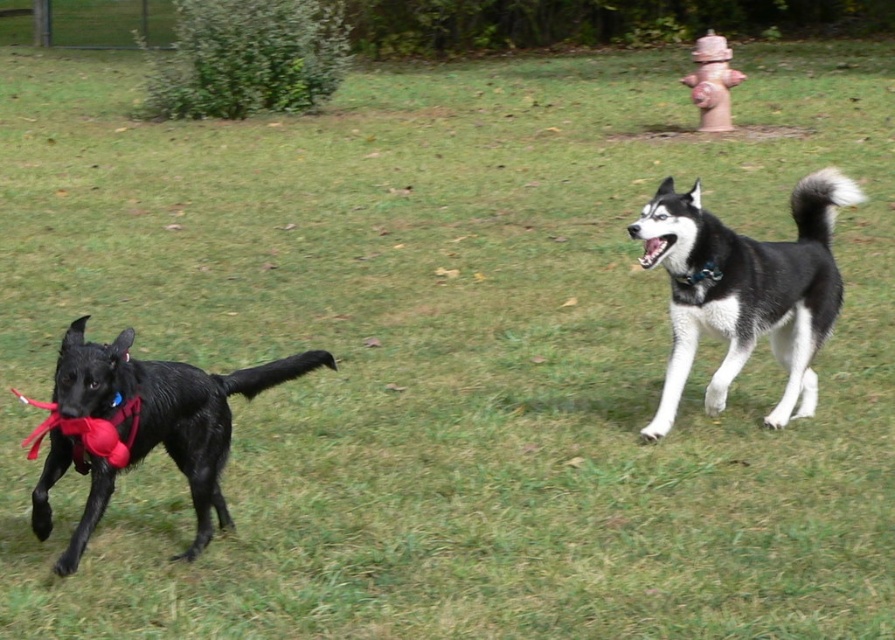
Does shiny black dog at left have a lesser height compared to white glossy teeth at upper center?

No, shiny black dog at left is not shorter than white glossy teeth at upper center.

Who is shorter, shiny black dog at left or white glossy teeth at upper center?

Standing shorter between the two is white glossy teeth at upper center.

Is point (82, 324) positioned behind point (644, 266)?

No, (82, 324) is in front of (644, 266).

What are the coordinates of `shiny black dog at left` in the screenshot? It's located at (167, 408).

Is black and white fur dog at right below shiny black dog at left?

No.

Consider the image. Measure the distance between black and white fur dog at right and shiny black dog at left.

The distance of black and white fur dog at right from shiny black dog at left is 1.92 meters.

In order to click on black and white fur dog at right in this screenshot , I will do `click(747, 291)`.

At what (x,y) coordinates should I click in order to perform the action: click on black and white fur dog at right. Please return your answer as a coordinate pair (x, y). Image resolution: width=895 pixels, height=640 pixels. Looking at the image, I should click on (747, 291).

Does black and white fur dog at right have a lesser height compared to white glossy teeth at upper center?

No, black and white fur dog at right is not shorter than white glossy teeth at upper center.

Is black and white fur dog at right below white glossy teeth at upper center?

Indeed, black and white fur dog at right is positioned under white glossy teeth at upper center.

This screenshot has height=640, width=895. Describe the element at coordinates (747, 291) in the screenshot. I see `black and white fur dog at right` at that location.

The width and height of the screenshot is (895, 640). What are the coordinates of `black and white fur dog at right` in the screenshot? It's located at (747, 291).